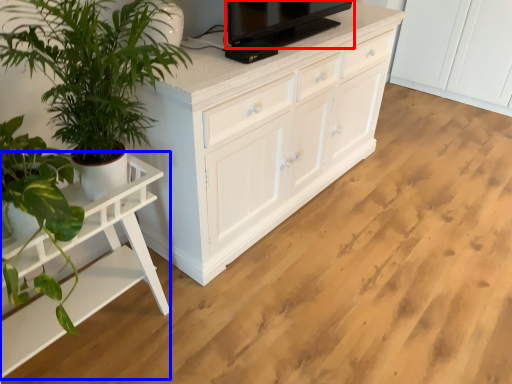
Question: Which object is further to the camera taking this photo, television (highlighted by a red box) or table (highlighted by a blue box)?

Choices:
 (A) television
 (B) table

Answer: (A)